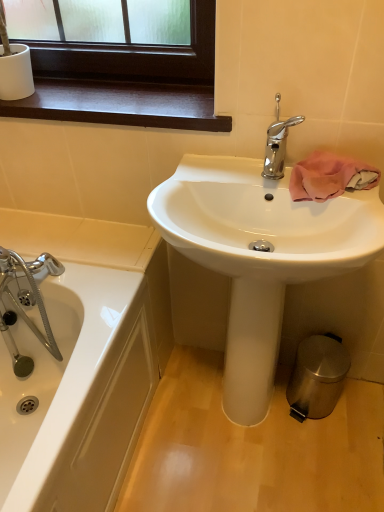
The width and height of the screenshot is (384, 512). What do you see at coordinates (253, 449) in the screenshot?
I see `metallic silver trash can at lower right` at bounding box center [253, 449].

At what (x,y) coordinates should I click in order to perform the action: click on polished stainless steel trash can at lower right. Please return your answer as a coordinate pair (x, y). Image resolution: width=384 pixels, height=512 pixels. Looking at the image, I should click on (317, 377).

Describe the element at coordinates (120, 104) in the screenshot. I see `dark wood window sill at upper left` at that location.

This screenshot has width=384, height=512. Identify the location of metallic silver trash can at lower right. pyautogui.click(x=253, y=449).

Which is more to the left, pink fabric towel at upper right or metallic silver trash can at lower right?

metallic silver trash can at lower right is more to the left.

Find the location of a particular element. Image resolution: width=384 pixels, height=512 pixels. plain below the pink fabric towel at upper right (from a real-world perspective) is located at coordinates (253, 449).

From the image's perspective, relative to metallic silver trash can at lower right, is pink fabric towel at upper right above or below?

Clearly, from the image's perspective, pink fabric towel at upper right is above metallic silver trash can at lower right.

Does pink fabric towel at upper right come in front of metallic silver trash can at lower right?

Yes.

From the image's perspective, between polished stainless steel trash can at lower right and white glossy sink at center, which one is located above?

From the image's view, white glossy sink at center is above.

Which is more to the left, polished stainless steel trash can at lower right or white glossy sink at center?

white glossy sink at center.

Does polished stainless steel trash can at lower right lie behind white glossy sink at center?

Yes, it is behind white glossy sink at center.

Which object is positioned more to the left, polished chrome faucet at upper center or metallic silver trash can at lower right?

metallic silver trash can at lower right is more to the left.

Locate an element on the screen. Image resolution: width=384 pixels, height=512 pixels. tap above the metallic silver trash can at lower right (from a real-world perspective) is located at coordinates (277, 144).

Does polished chrome faucet at upper center lie in front of metallic silver trash can at lower right?

Yes.

Is point (320, 215) closer to camera compared to point (335, 345)?

Yes, it is.

Looking at their sizes, would you say white glossy sink at center is wider or thinner than polished stainless steel trash can at lower right?

Considering their sizes, white glossy sink at center looks broader than polished stainless steel trash can at lower right.

Looking at the image, does white glossy sink at center seem bigger or smaller compared to polished stainless steel trash can at lower right?

Considering their sizes, white glossy sink at center takes up more space than polished stainless steel trash can at lower right.

Which object is more forward, white glossy sink at center or polished stainless steel trash can at lower right?

white glossy sink at center is more forward.

Would you consider pink fabric towel at upper right to be distant from polished stainless steel trash can at lower right?

No.

I want to click on trash bin/can below the pink fabric towel at upper right (from the image's perspective), so click(x=317, y=377).

From the image's perspective, which object appears higher, pink fabric towel at upper right or polished stainless steel trash can at lower right?

pink fabric towel at upper right appears higher in the image.

Is pink fabric towel at upper right at the right side of polished stainless steel trash can at lower right?

Incorrect, pink fabric towel at upper right is not on the right side of polished stainless steel trash can at lower right.

Between polished stainless steel trash can at lower right and pink fabric towel at upper right, which one appears on the right side from the viewer's perspective?

polished stainless steel trash can at lower right is more to the right.

Is pink fabric towel at upper right inside polished stainless steel trash can at lower right?

No, pink fabric towel at upper right is not surrounded by polished stainless steel trash can at lower right.

Considering the positions of objects polished stainless steel trash can at lower right and pink fabric towel at upper right in the image provided, who is behind, polished stainless steel trash can at lower right or pink fabric towel at upper right?

polished stainless steel trash can at lower right is further away from the camera.

Is dark wood window sill at upper left facing away from white glossy sink at center?

No.

Which object is positioned more to the right, dark wood window sill at upper left or white glossy sink at center?

From the viewer's perspective, white glossy sink at center appears more on the right side.

From the image's perspective, is dark wood window sill at upper left beneath white glossy sink at center?

No, from the image's perspective, dark wood window sill at upper left is not below white glossy sink at center.

At what (x,y) coordinates should I click in order to perform the action: click on bath towel above the metallic silver trash can at lower right (from a real-world perspective). Please return your answer as a coordinate pair (x, y). Looking at the image, I should click on tap(324, 176).

The width and height of the screenshot is (384, 512). I want to click on trash bin/can that appears on the right of white glossy sink at center, so click(317, 377).

Considering their positions, is dark wood window sill at upper left positioned further to pink fabric towel at upper right than polished chrome faucet at upper center?

Based on the image, dark wood window sill at upper left appears to be further to pink fabric towel at upper right.

From the image, which object appears to be nearer to pink fabric towel at upper right, metallic silver trash can at lower right or polished stainless steel trash can at lower right?

polished stainless steel trash can at lower right is positioned closer to the anchor pink fabric towel at upper right.

Considering their positions, is polished stainless steel trash can at lower right positioned further to dark wood window sill at upper left than white glossy sink at center?

polished stainless steel trash can at lower right lies further to dark wood window sill at upper left than the other object.

When comparing their distances from pink fabric towel at upper right, does dark wood window sill at upper left or metallic silver trash can at lower right seem closer?

The object closer to pink fabric towel at upper right is dark wood window sill at upper left.

When comparing their distances from pink fabric towel at upper right, does polished stainless steel trash can at lower right or dark wood window sill at upper left seem closer?

The object closer to pink fabric towel at upper right is dark wood window sill at upper left.

From the image, which object appears to be nearer to metallic silver trash can at lower right, white glossy sink at center or polished stainless steel trash can at lower right?

The object closer to metallic silver trash can at lower right is polished stainless steel trash can at lower right.

Estimate the real-world distances between objects in this image. Which object is closer to polished chrome faucet at upper center, polished stainless steel trash can at lower right or white glossy sink at center?

white glossy sink at center lies closer to polished chrome faucet at upper center than the other object.

When comparing their distances from polished stainless steel trash can at lower right, does metallic silver trash can at lower right or polished chrome faucet at upper center seem further?

Based on the image, polished chrome faucet at upper center appears to be further to polished stainless steel trash can at lower right.

What are the coordinates of `bath towel between dark wood window sill at upper left and metallic silver trash can at lower right vertically` in the screenshot? It's located at (x=324, y=176).

Locate an element on the screen. sink between polished chrome faucet at upper center and metallic silver trash can at lower right in the up-down direction is located at coordinates (261, 254).

Find the location of a particular element. The height and width of the screenshot is (512, 384). sink between dark wood window sill at upper left and metallic silver trash can at lower right vertically is located at coordinates (261, 254).

Locate an element on the screen. This screenshot has width=384, height=512. bath towel between dark wood window sill at upper left and white glossy sink at center from top to bottom is located at coordinates (324, 176).